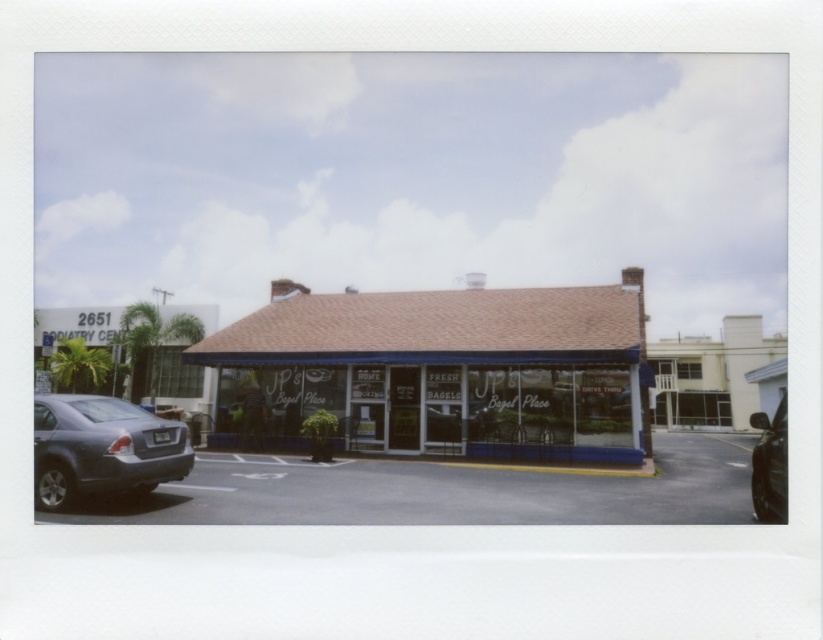
Question: Which object is positioned closest to the shiny black car at lower right?

Choices:
 (A) gray asphalt parking lot at lower left
 (B) matte gray sedan at lower left

Answer: (A)

Question: Is white glass storefront at center bigger than shiny black car at lower right?

Choices:
 (A) yes
 (B) no

Answer: (B)

Question: Which object appears farthest from the camera in this image?

Choices:
 (A) matte gray sedan at lower left
 (B) shiny black car at lower right
 (C) gray asphalt parking lot at lower left
 (D) white glass storefront at center

Answer: (D)

Question: Is the position of white glass storefront at center less distant than that of shiny black car at lower right?

Choices:
 (A) no
 (B) yes

Answer: (A)

Question: Which object appears closest to the camera in this image?

Choices:
 (A) shiny black car at lower right
 (B) gray asphalt parking lot at lower left
 (C) matte gray sedan at lower left
 (D) white glass storefront at center

Answer: (A)

Question: Can you confirm if gray asphalt parking lot at lower left is positioned below shiny black car at lower right?

Choices:
 (A) no
 (B) yes

Answer: (A)